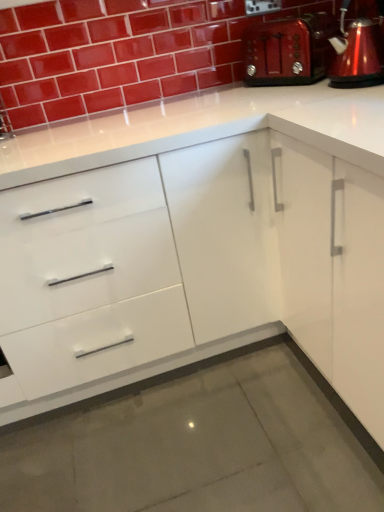
What are the coordinates of `vacant space positioned to the left of metallic red coffeepot at upper right` in the screenshot? It's located at (293, 97).